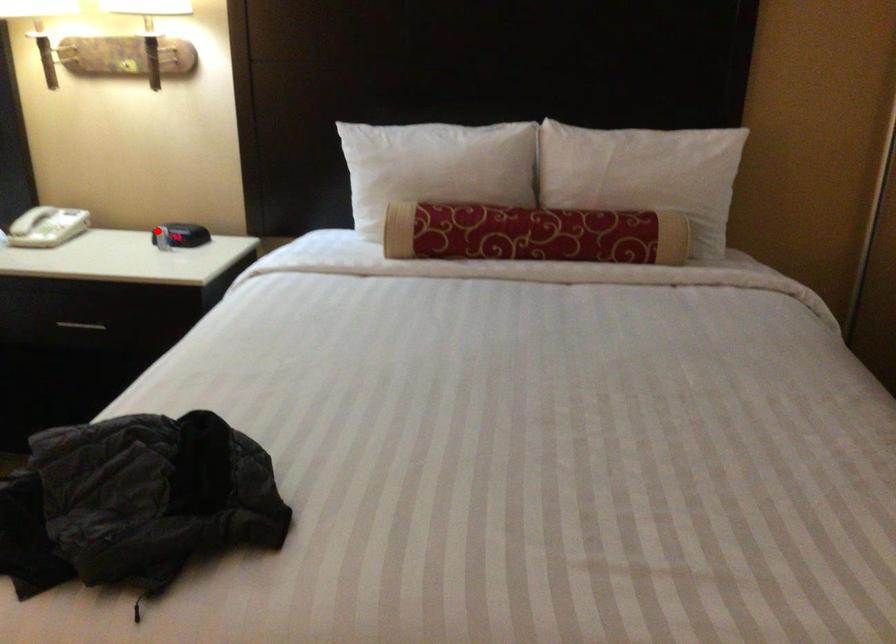
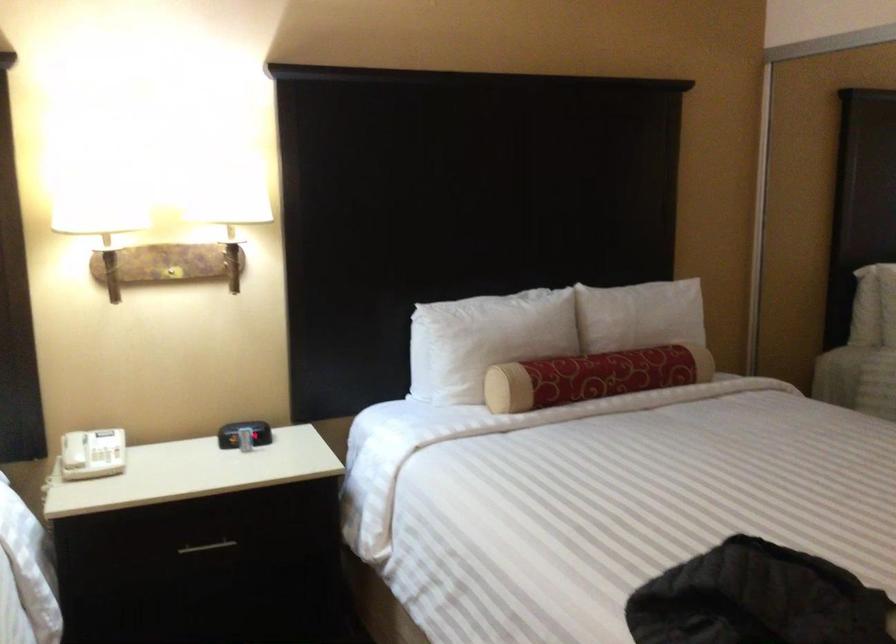
Locate, in the second image, the point that corresponds to the highlighted location in the first image.

(244, 433)